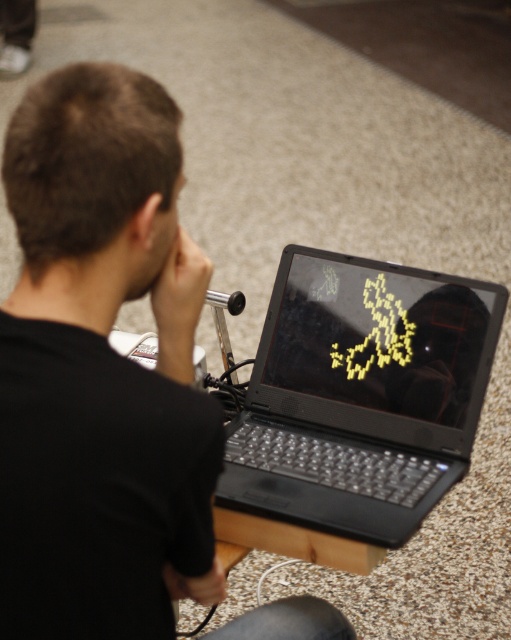
Can you confirm if black matte laptop at center is positioned below black glossy laptop at center?

Correct, black matte laptop at center is located below black glossy laptop at center.

Does point (452, 355) come closer to viewer compared to point (416, 360)?

That is True.

At what (x,y) coordinates should I click in order to perform the action: click on black matte laptop at center. Please return your answer as a coordinate pair (x, y). This screenshot has width=511, height=640. Looking at the image, I should click on (360, 394).